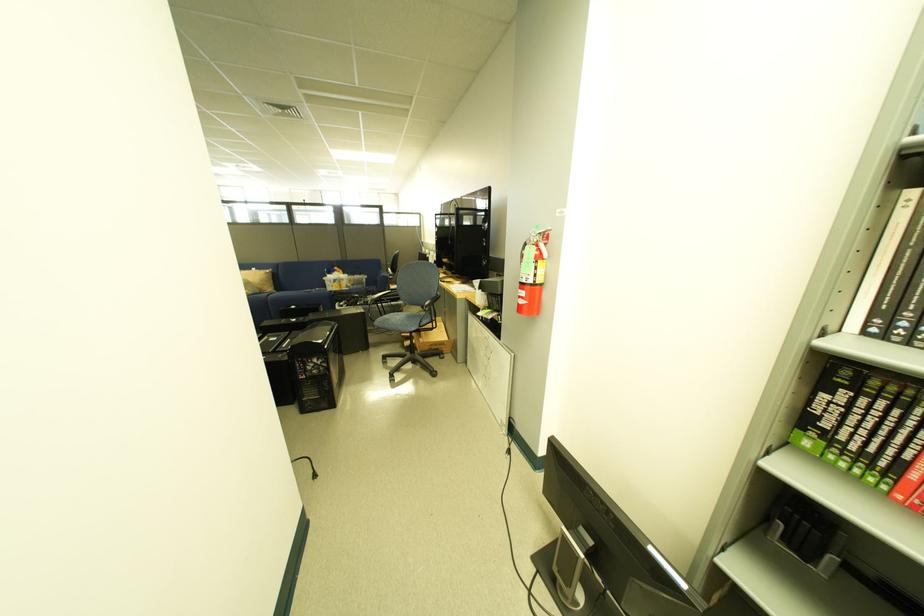
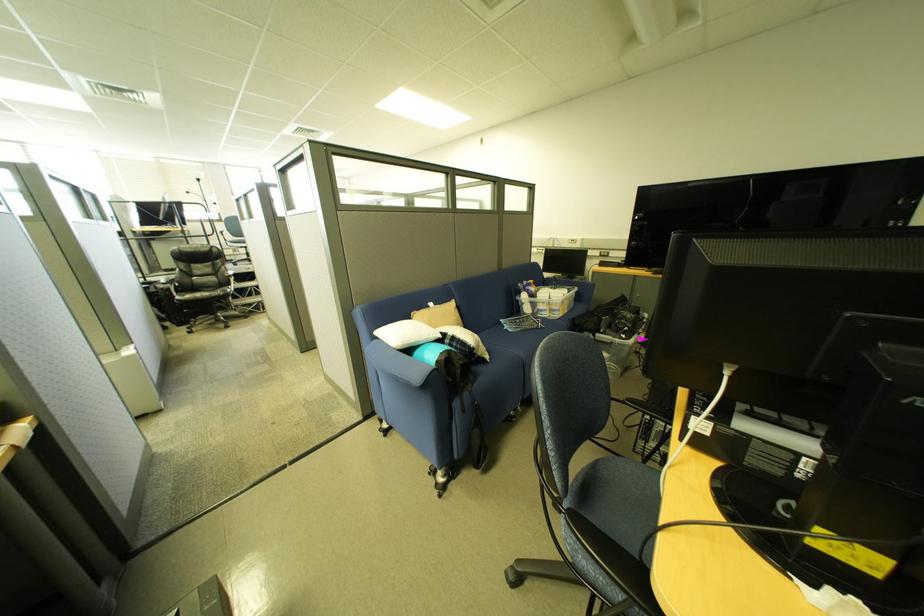
From the picture: Which direction would the cameraman need to move to produce the second image?

The cameraman walked toward left, forward.